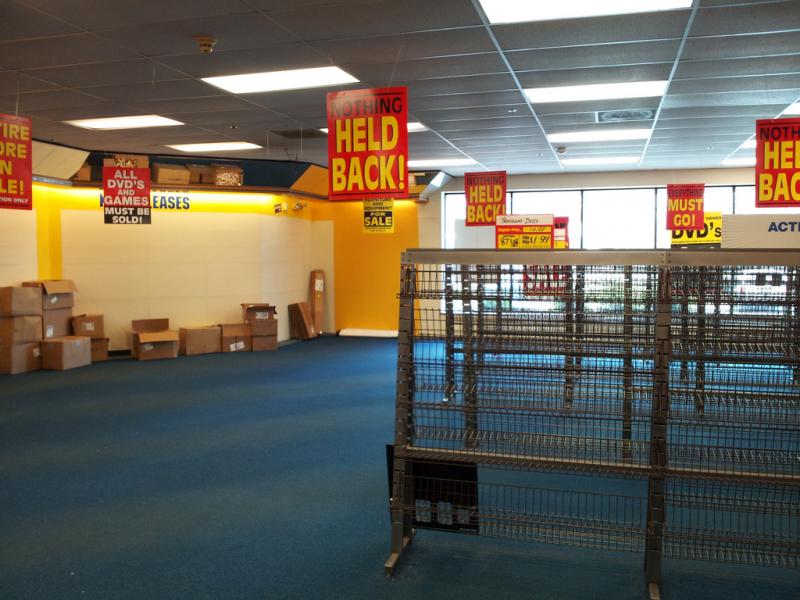
What are the coordinates of `yellow wall` in the screenshot? It's located at (190, 280).